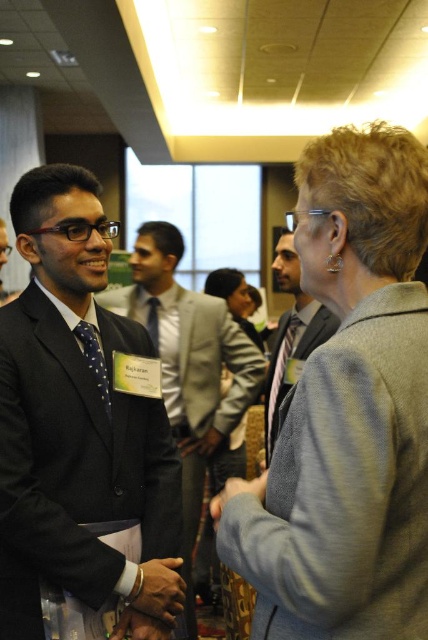
Based on the photo, you are at a networking event and notice two items of clothing. The polished dark suit at left is being worn by a man, and the matte blue tie at center is part of his outfit. Which item is higher up on his body?

The polished dark suit at left is taller than the matte blue tie at center, so the polished dark suit at left is higher up on his body.

You are standing at the entrance of the conference room and need to locate the gray woolen jacket at upper right. According to the coordinates provided, where should you look relative to the center of the image?

The gray woolen jacket at upper right is located at coordinates point 0.644 on the x axis and 0.813 on the y axis, which means it is positioned to the right and above the center of the image.

You are organizing a photo shoot and need to ensure that all attire items are displayed proportionally. Given the polished dark suit at left and the matte blue tie at center, which item would require a larger display space based on their actual sizes?

The polished dark suit at left requires a larger display space since it has a larger size compared to the matte blue tie at center.